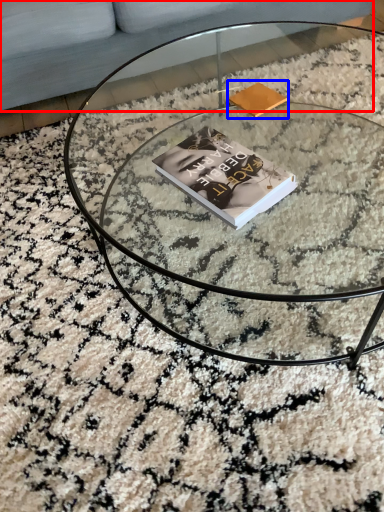
Question: Among these objects, which one is farthest to the camera, couch (highlighted by a red box) or paperback book (highlighted by a blue box)?

Choices:
 (A) couch
 (B) paperback book

Answer: (A)